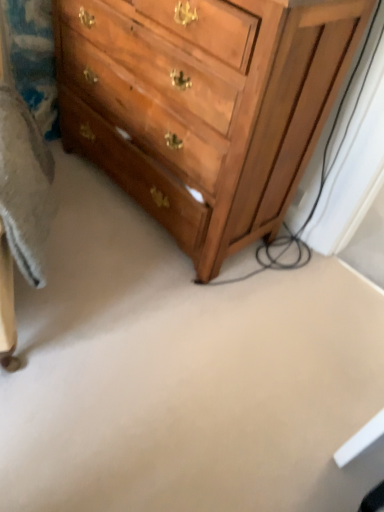
Describe the element at coordinates (203, 106) in the screenshot. I see `wooden chest of drawers at upper right` at that location.

Locate an element on the screen. Image resolution: width=384 pixels, height=512 pixels. wooden chest of drawers at upper right is located at coordinates (203, 106).

You are a GUI agent. You are given a task and a screenshot of the screen. Output one action in this format:
    pyautogui.click(x=<x>, y=<y>)
    Task: Click on the wooden chest of drawers at upper right
    The width and height of the screenshot is (384, 512).
    Given the screenshot: What is the action you would take?
    pyautogui.click(x=203, y=106)